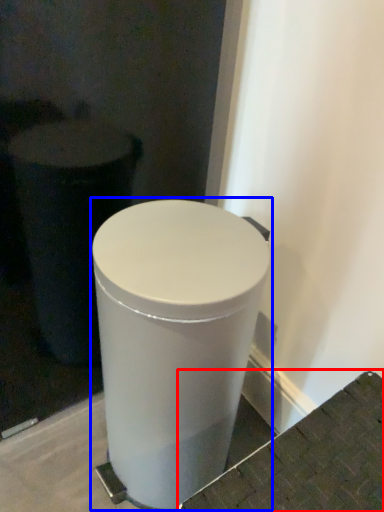
Question: Which object is closer to the camera taking this photo, concrete (highlighted by a red box) or waste container (highlighted by a blue box)?

Choices:
 (A) concrete
 (B) waste container

Answer: (A)